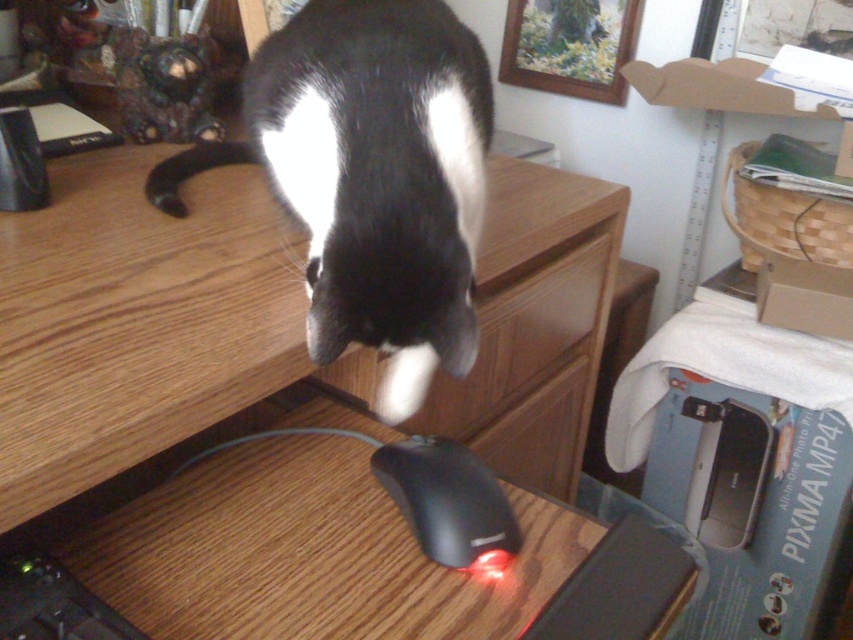
You are organizing items on a desk and need to place the wooden drawer at center and the black matte mouse at center. If you have a space that can only fit the smaller item, which one should you place there?

The black matte mouse at center is smaller than the wooden drawer at center, so you should place the black matte mouse at center in the smaller space.